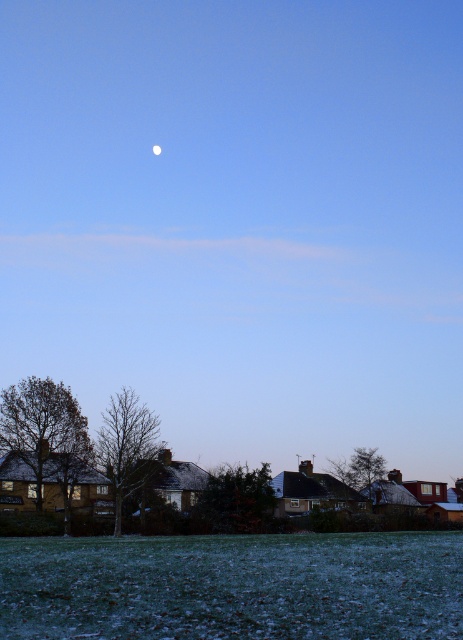
Can you confirm if green frosty grass at lower center is bigger than green leafy tree at center?

No, green frosty grass at lower center is not bigger than green leafy tree at center.

Is green frosty grass at lower center to the left of green leafy tree at center from the viewer's perspective?

Yes, green frosty grass at lower center is to the left of green leafy tree at center.

The image size is (463, 640). I want to click on green frosty grass at lower center, so click(233, 586).

Locate an element on the screen. This screenshot has width=463, height=640. green frosty grass at lower center is located at coordinates (233, 586).

Is green matte tree at center positioned in front of green leafy tree at center?

Yes, green matte tree at center is closer to the viewer.

Can you confirm if green matte tree at center is positioned to the left of green leafy tree at center?

Yes, green matte tree at center is to the left of green leafy tree at center.

At what (x,y) coordinates should I click in order to perform the action: click on green matte tree at center. Please return your answer as a coordinate pair (x, y). This screenshot has width=463, height=640. Looking at the image, I should click on (237, 499).

Who is taller, brown leafless tree at lower left or green matte tree at center?

Standing taller between the two is brown leafless tree at lower left.

Identify the location of brown leafless tree at lower left. This screenshot has height=640, width=463. (45, 435).